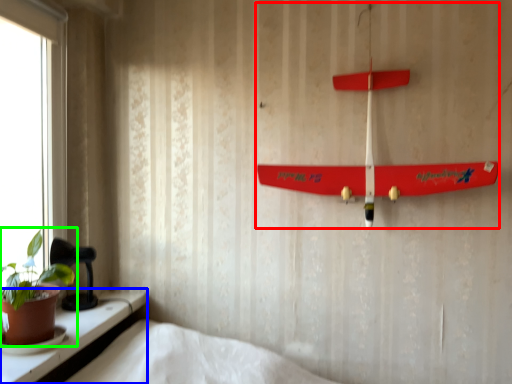
Question: Considering the real-world distances, which object is closest to toy (highlighted by a red box)? window (highlighted by a blue box) or houseplant (highlighted by a green box).

Choices:
 (A) window
 (B) houseplant

Answer: (A)